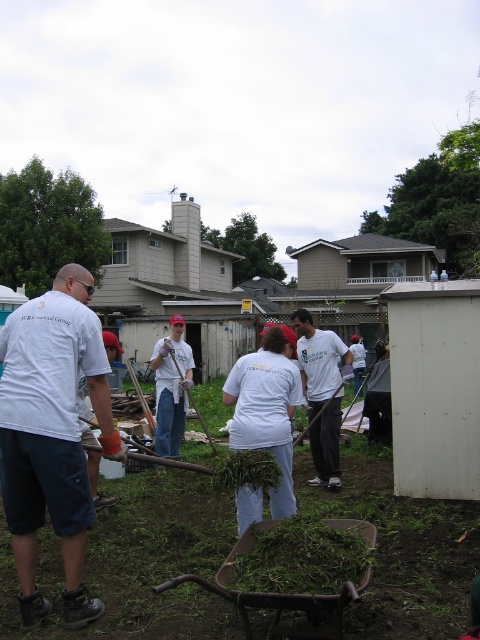
What are the coordinates of `green leafy grass at center` in the screenshot? It's located at (140, 563).

Does green leafy grass at center have a greater width compared to white cotton t-shirt at center?

No, green leafy grass at center is not wider than white cotton t-shirt at center.

Between point (48, 557) and point (305, 385), which one is positioned behind?

The point (305, 385) is more distant.

This screenshot has width=480, height=640. Find the location of `green leafy grass at center`. green leafy grass at center is located at coordinates (140, 563).

Does point (119, 636) come closer to viewer compared to point (187, 406)?

Yes, point (119, 636) is in front of point (187, 406).

Does green leafy grass at center have a greater height compared to white cotton shirt at center?

In fact, green leafy grass at center may be shorter than white cotton shirt at center.

Locate an element on the screen. The image size is (480, 640). green leafy grass at center is located at coordinates (140, 563).

Identify the location of green leafy grass at center. (140, 563).